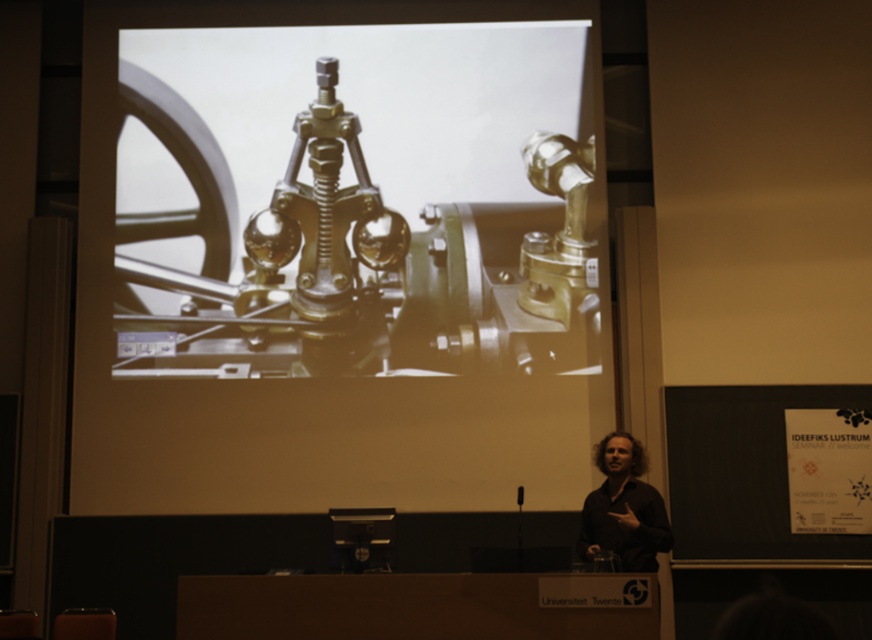
Who is positioned more to the right, gold metallic machinery at center or dark brown hair at lower right?

Positioned to the right is dark brown hair at lower right.

Does gold metallic machinery at center have a smaller size compared to dark brown hair at lower right?

Actually, gold metallic machinery at center might be larger than dark brown hair at lower right.

Where is `gold metallic machinery at center`? gold metallic machinery at center is located at coordinates (346, 260).